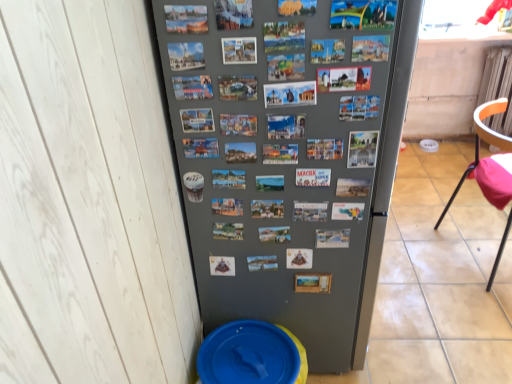
Locate an element on the screen. The width and height of the screenshot is (512, 384). free spot below orange plastic chair at right (from a real-world perspective) is located at coordinates (479, 251).